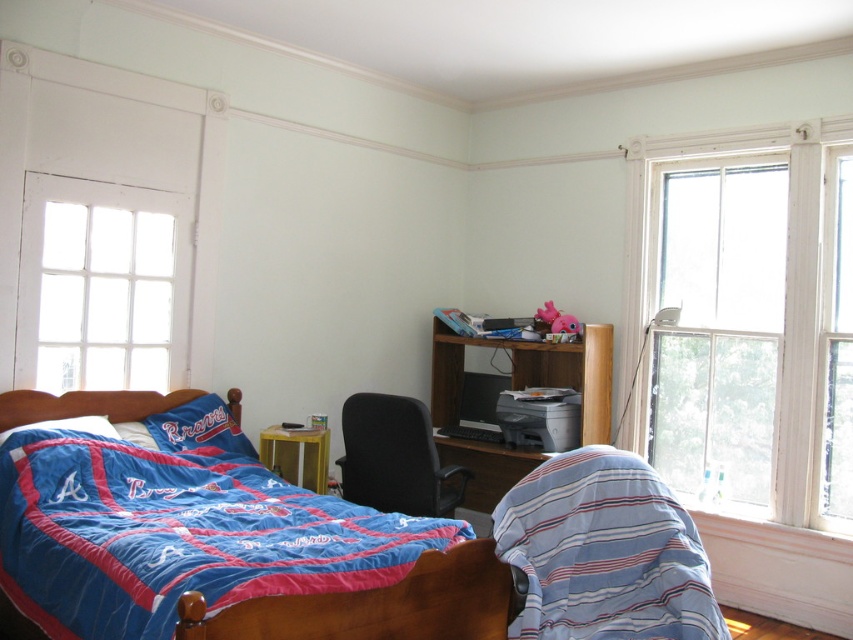
Question: Which object appears farthest from the camera in this image?

Choices:
 (A) wooden desk at center
 (B) blue fabric bed at lower left

Answer: (A)

Question: Among these points, which one is farthest from the camera?

Choices:
 (A) (239, 628)
 (B) (460, 364)
 (C) (665, 369)

Answer: (B)

Question: Where is clear glass window at upper left located in relation to blue fabric bed at lower left in the image?

Choices:
 (A) above
 (B) below

Answer: (A)

Question: Estimate the real-world distances between objects in this image. Which object is closer to the blue fabric bed at lower left?

Choices:
 (A) wooden desk at center
 (B) clear glass window at upper left
 (C) black fabric chair at center

Answer: (C)

Question: Is clear glass window at upper left below blue fabric bed at lower left?

Choices:
 (A) no
 (B) yes

Answer: (A)

Question: Can you confirm if blue striped blanket at lower right is positioned above blue fabric bed at lower left?

Choices:
 (A) no
 (B) yes

Answer: (B)